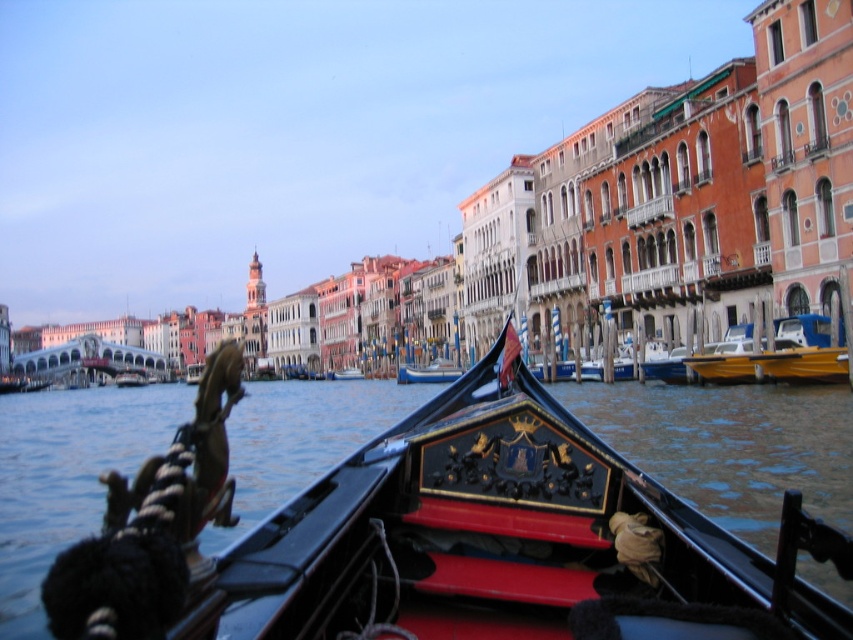
Question: Can you confirm if glossy water at center is positioned above wooden gondola at center?

Choices:
 (A) yes
 (B) no

Answer: (B)

Question: Which point is closer to the camera?

Choices:
 (A) (415, 369)
 (B) (788, 445)

Answer: (B)

Question: Can you confirm if glossy water at center is bigger than wooden gondola at center?

Choices:
 (A) yes
 (B) no

Answer: (A)

Question: From the image, what is the correct spatial relationship of glossy water at center in relation to wooden gondola at center?

Choices:
 (A) left
 (B) right

Answer: (A)